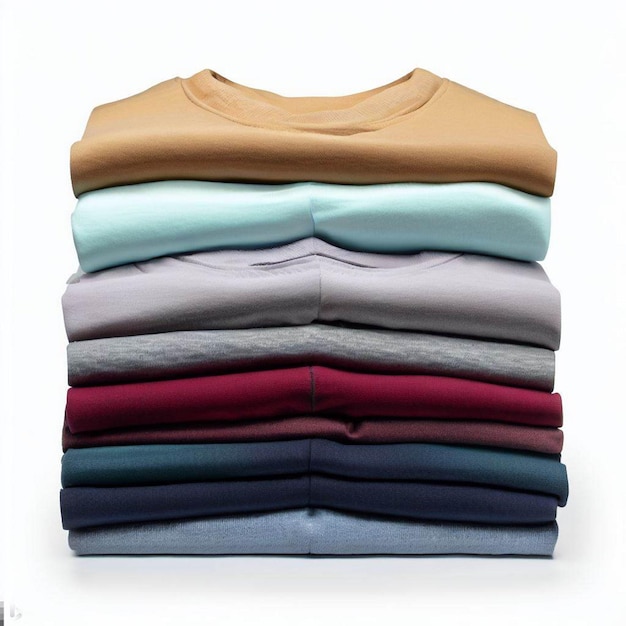
Locate an element on the screen. This screenshot has width=626, height=626. folded shirts is located at coordinates (309, 163), (307, 203), (313, 275), (309, 342), (300, 385), (300, 427), (302, 454), (297, 488), (297, 523).